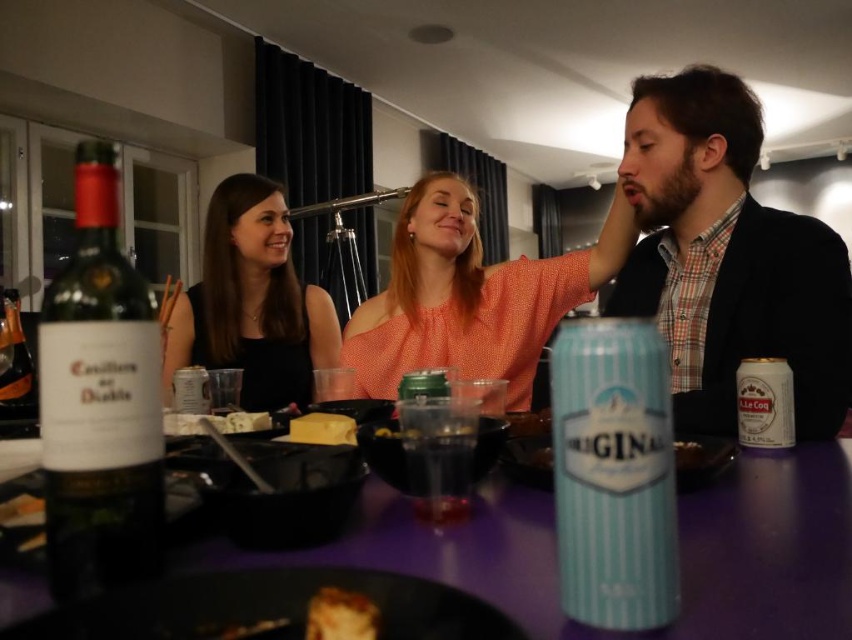
Is point (104, 348) closer to camera compared to point (329, 324)?

Yes, point (104, 348) is in front of point (329, 324).

Does green glass bottle at left have a lesser height compared to black matte dress at center?

Incorrect, green glass bottle at left's height does not fall short of black matte dress at center's.

Does point (113, 396) come behind point (164, 371)?

No, (113, 396) is closer to viewer.

The image size is (852, 640). Identify the location of green glass bottle at left. (99, 401).

Between green glass bottle at left and yellow cheese at center, which one has less height?

With less height is yellow cheese at center.

Who is higher up, green glass bottle at left or yellow cheese at center?

green glass bottle at left is above.

Who is more forward, (56, 481) or (330, 419)?

Point (56, 481) is in front.

Locate an element on the screen. This screenshot has height=640, width=852. green glass bottle at left is located at coordinates (99, 401).

Can you confirm if checkered fabric shirt at center is thinner than purple glossy table at center?

Yes.

Locate an element on the screen. This screenshot has height=640, width=852. checkered fabric shirt at center is located at coordinates (727, 257).